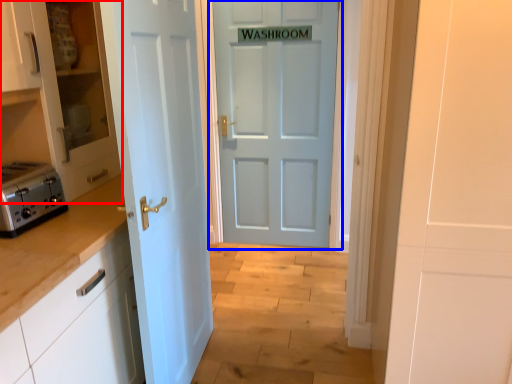
Question: Which point is closer to the camera, cabinetry (highlighted by a red box) or door (highlighted by a blue box)?

Choices:
 (A) cabinetry
 (B) door

Answer: (A)